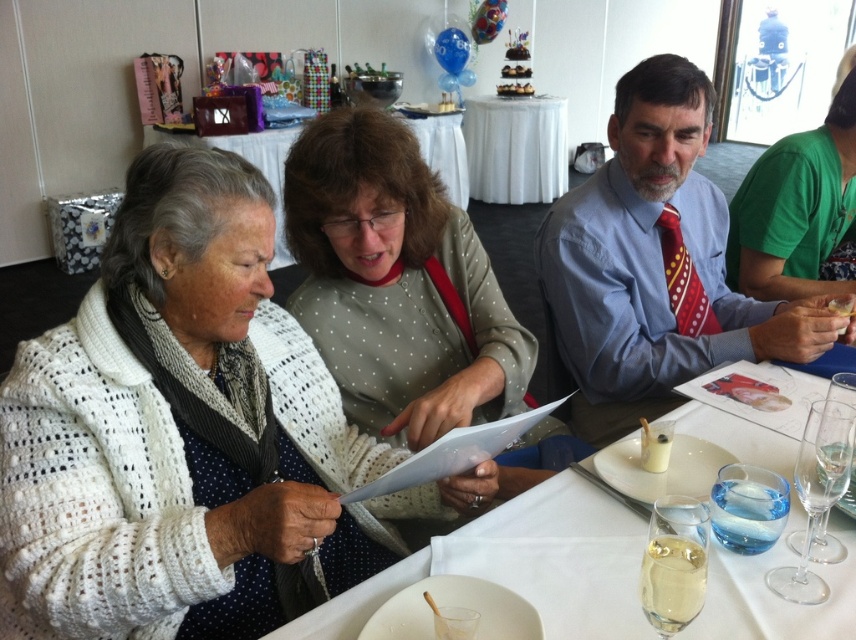
Does white paper at center appear under clear glass wine glass at lower center?

Correct, white paper at center is located below clear glass wine glass at lower center.

Is white paper at center smaller than clear glass wine glass at lower center?

No.

At what (x,y) coordinates should I click in order to perform the action: click on white paper at center. Please return your answer as a coordinate pair (x, y). The image size is (856, 640). Looking at the image, I should click on (474, 536).

Can you confirm if white paper at center is thinner than yellowish-brown crumbly bread at lower center?

No.

Who is more forward, (745, 440) or (843, 305)?

Positioned in front is point (745, 440).

Between point (522, 522) and point (853, 308), which one is positioned behind?

Point (853, 308)

The image size is (856, 640). In order to click on white paper at center in this screenshot , I will do `click(474, 536)`.

Between white paper at center and white cloth table at upper center, which one has more height?

With more height is white cloth table at upper center.

Image resolution: width=856 pixels, height=640 pixels. Identify the location of white paper at center. (474, 536).